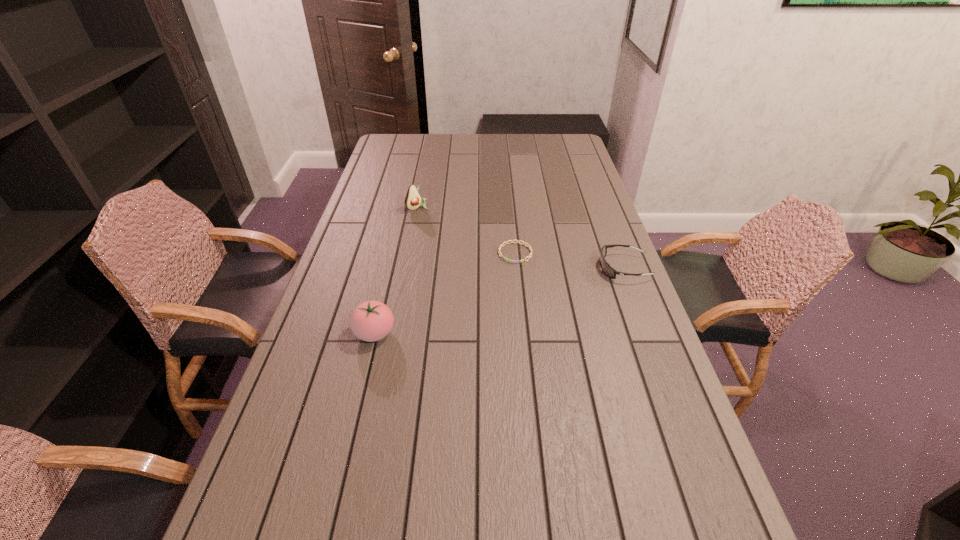
Locate an element on the screen. tomato is located at coordinates (371, 321).

You are a GUI agent. You are given a task and a screenshot of the screen. Output one action in this format:
    pyautogui.click(x=<x>, y=<y>)
    Task: Click on the rightmost object
    The image size is (960, 540).
    Given the screenshot: What is the action you would take?
    pyautogui.click(x=605, y=266)

In order to click on goggles in this screenshot , I will do `click(605, 266)`.

Locate an element on the screen. The height and width of the screenshot is (540, 960). the shortest object is located at coordinates (513, 261).

This screenshot has height=540, width=960. In order to click on bracelet in this screenshot , I will do `click(513, 261)`.

Locate an element on the screen. This screenshot has height=540, width=960. the farthest object is located at coordinates (413, 200).

Image resolution: width=960 pixels, height=540 pixels. Find the location of `blank space located 0.090m on the right of the nearest object`. blank space located 0.090m on the right of the nearest object is located at coordinates (429, 333).

You are a GUI agent. You are given a task and a screenshot of the screen. Output one action in this format:
    pyautogui.click(x=<x>, y=<y>)
    Task: Click on the vacant position located on the lenses of the rightmost object
    The height and width of the screenshot is (540, 960).
    Given the screenshot: What is the action you would take?
    pyautogui.click(x=493, y=268)

At what (x,y) coordinates should I click in order to perform the action: click on blank space located on the lenses of the rightmost object. Please return your answer as a coordinate pair (x, y). Looking at the image, I should click on (576, 268).

Identify the location of vacant area situated on the lenses of the rightmost object. (x=573, y=268).